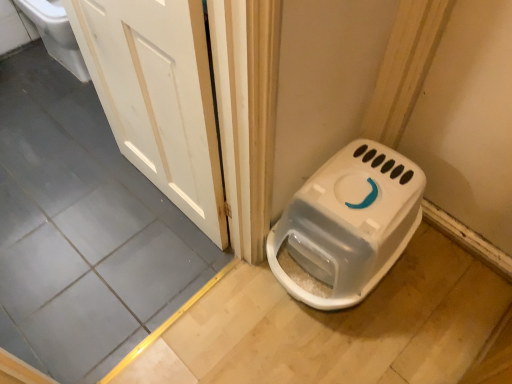
At what (x,y) coordinates should I click in order to perform the action: click on vacant region to the right of white plastic litter box at lower right. Please return your answer as a coordinate pair (x, y). This screenshot has height=384, width=512. Looking at the image, I should click on (437, 292).